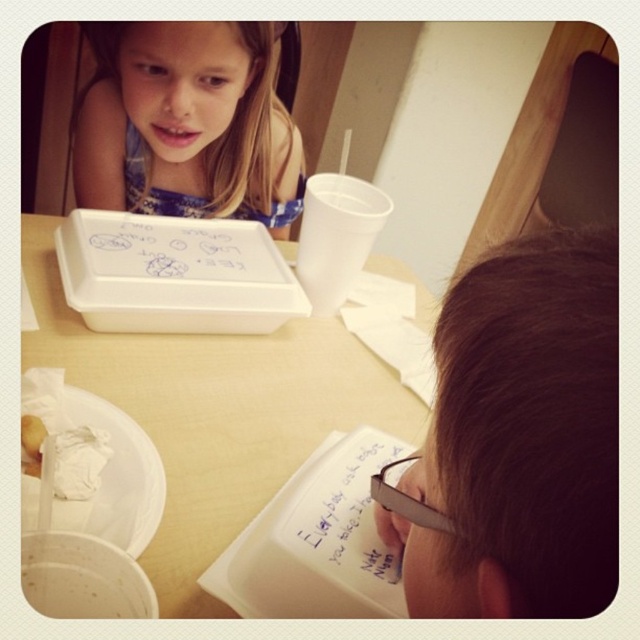
What object is located at the coordinates point (212, 412)?

The white plastic tray at center is located at point (212, 412).

From the picture: A parent is trying to ensure their child can easily reach both the brown hair at upper right and the white plastic tray at center during a meal. Given that the child can comfortably reach up to 12 inches, will they be able to reach both items without moving their chair?

The brown hair at upper right is 12.27 inches away from the white plastic tray at center. Since the distance between them is slightly more than the child can reach comfortably, the child might need to adjust their position to access both items.